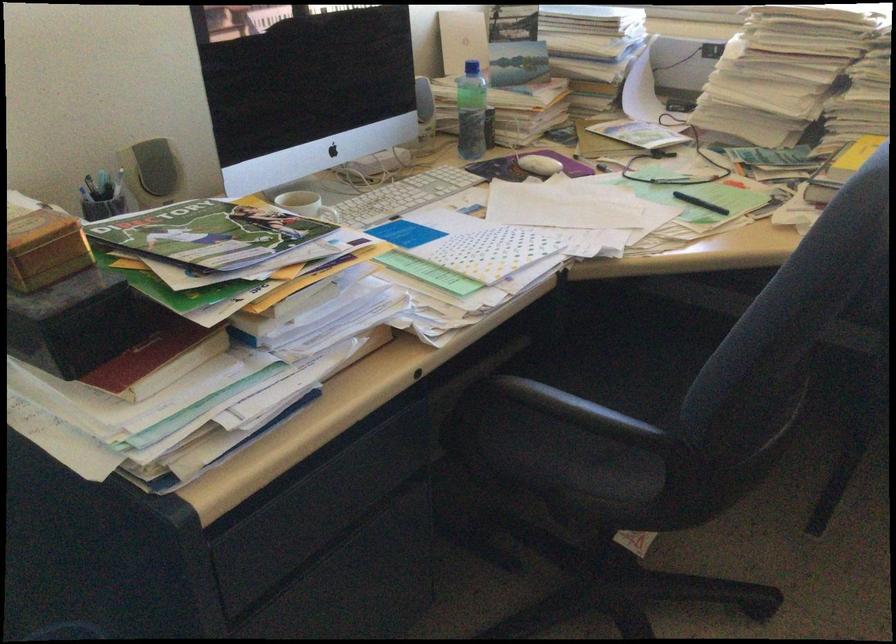
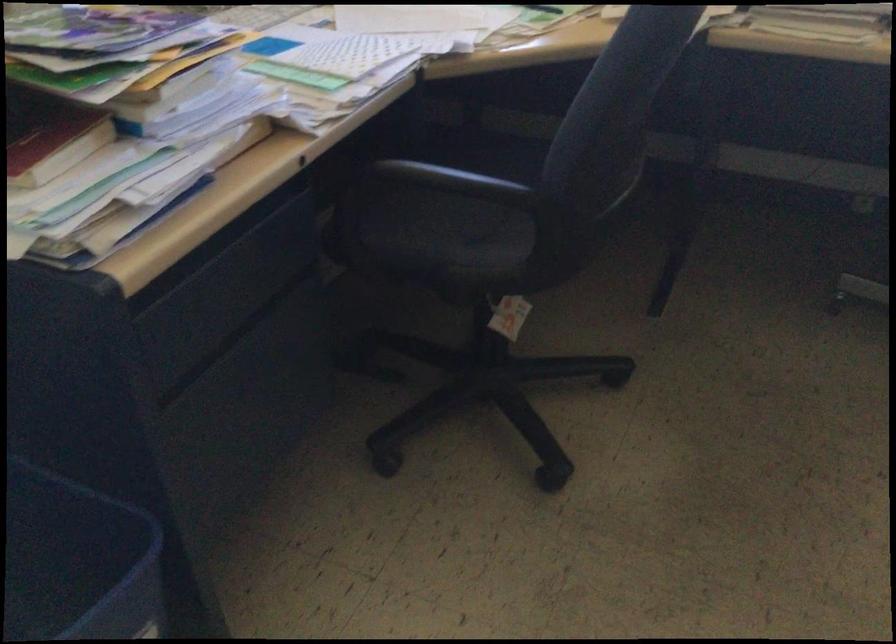
Question: The first image is from the beginning of the video and the second image is from the end. How did the camera likely rotate when shooting the video?

Choices:
 (A) Left
 (B) Right
 (C) Up
 (D) Down

Answer: (B)